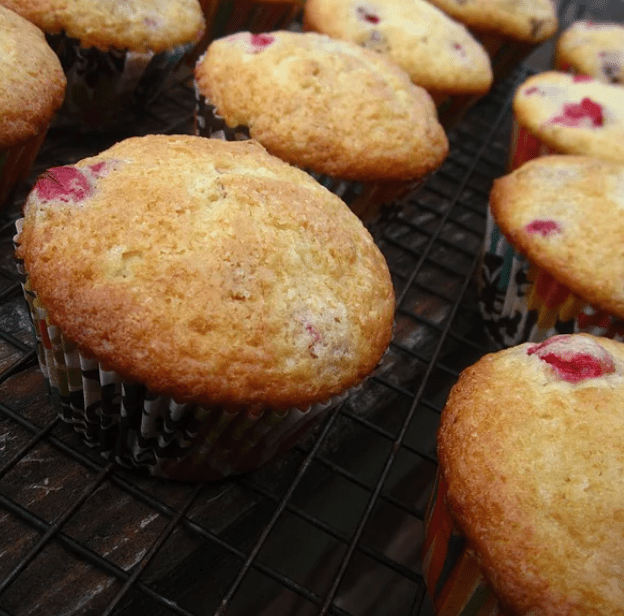
You are a GUI agent. You are given a task and a screenshot of the screen. Output one action in this format:
    pyautogui.click(x=<x>, y=<y>)
    Task: Click on the wire rack
    Image resolution: width=624 pixels, height=616 pixels.
    Given the screenshot: What is the action you would take?
    pyautogui.click(x=339, y=531)